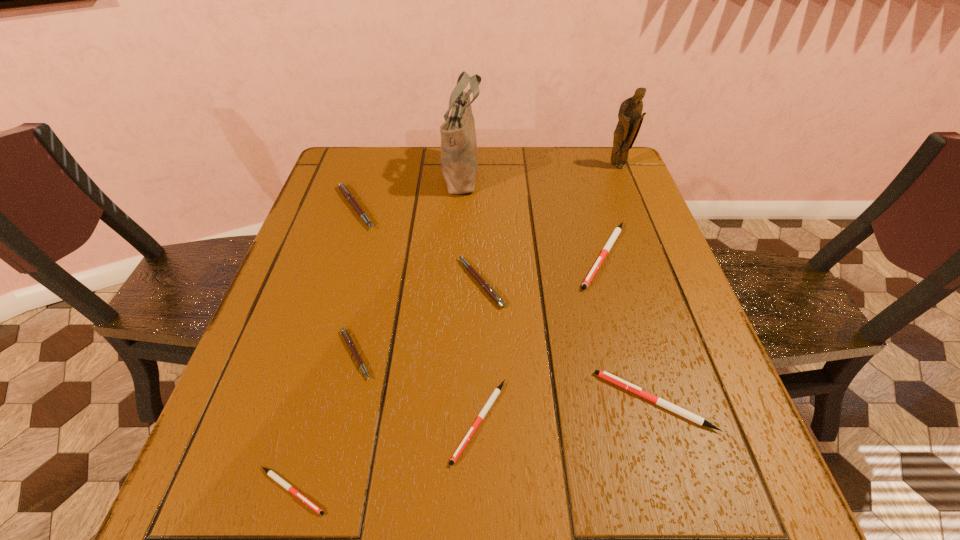
This screenshot has height=540, width=960. What are the coordinates of `shoulder bag` in the screenshot? It's located at (459, 159).

Locate an element on the screen. the tallest object is located at coordinates (459, 159).

Locate an element on the screen. This screenshot has height=540, width=960. figurine is located at coordinates (630, 116).

Where is `the farthest pink pen`? This screenshot has width=960, height=540. the farthest pink pen is located at coordinates (350, 198).

I want to click on the farthest white pen, so click(x=616, y=232).

Locate an element on the screen. The width and height of the screenshot is (960, 540). the second biggest pink pen is located at coordinates (490, 291).

Locate an element on the screen. This screenshot has height=540, width=960. the rightmost pink pen is located at coordinates coord(490,291).

Where is `the third smallest white pen`? This screenshot has height=540, width=960. the third smallest white pen is located at coordinates tap(605, 375).

At what (x,y) coordinates should I click in order to perform the action: click on the smallest pink pen. Please return your answer as a coordinate pair (x, y). Looking at the image, I should click on (344, 332).

At what (x,y) coordinates should I click in order to perform the action: click on the second smallest white pen. Please return your answer as a coordinate pair (x, y). The image size is (960, 540). Looking at the image, I should click on (496, 392).